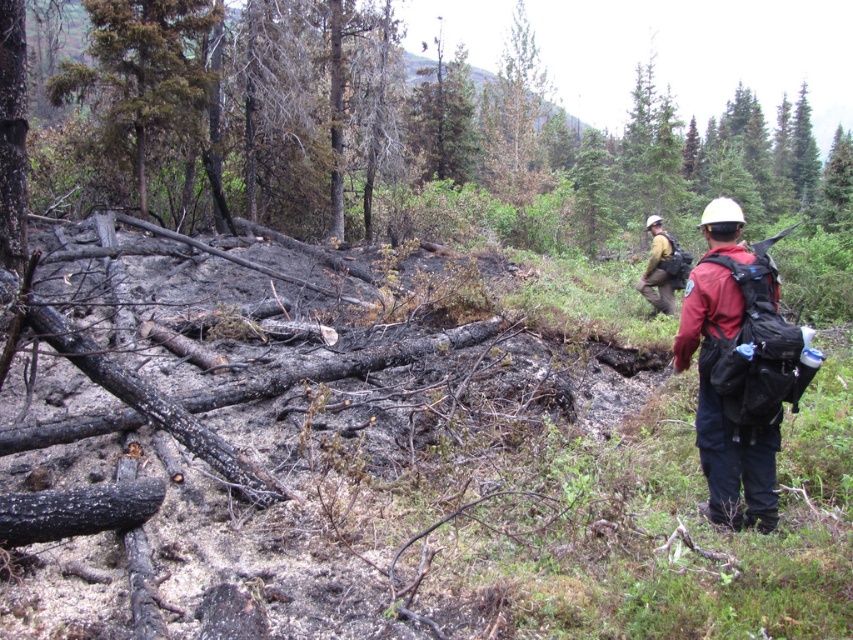
Is matte red jacket at right positioned in front of dark green coniferous tree at upper left?

That is True.

Which is above, matte red jacket at right or dark green coniferous tree at upper left?

Positioned higher is dark green coniferous tree at upper left.

Describe the element at coordinates (732, 369) in the screenshot. I see `matte red jacket at right` at that location.

At what (x,y) coordinates should I click in order to perform the action: click on matte red jacket at right. Please return your answer as a coordinate pair (x, y). This screenshot has height=640, width=853. Looking at the image, I should click on (732, 369).

This screenshot has height=640, width=853. Describe the element at coordinates (732, 369) in the screenshot. I see `matte red jacket at right` at that location.

Does matte red jacket at right have a greater width compared to camouflage jacket at right?

Incorrect, matte red jacket at right's width does not surpass camouflage jacket at right's.

Describe the element at coordinates (732, 369) in the screenshot. I see `matte red jacket at right` at that location.

At what (x,y) coordinates should I click in order to perform the action: click on matte red jacket at right. Please return your answer as a coordinate pair (x, y). Looking at the image, I should click on (732, 369).

What are the coordinates of `dark green coniferous tree at upper left` in the screenshot? It's located at (140, 64).

Which is behind, point (190, 92) or point (660, 221)?

Point (190, 92)

What do you see at coordinates (140, 64) in the screenshot?
I see `dark green coniferous tree at upper left` at bounding box center [140, 64].

I want to click on dark green coniferous tree at upper left, so click(x=140, y=64).